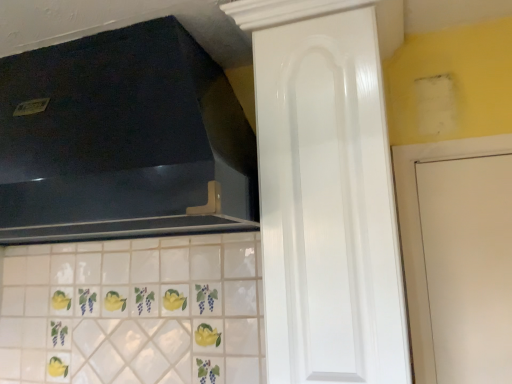
Measure the distance between point (276, 61) and camera.

Point (276, 61) and camera are 3.34 feet apart.

The width and height of the screenshot is (512, 384). In order to click on white glossy cabinet door at center in this screenshot , I will do `click(328, 205)`.

Describe the element at coordinates (328, 205) in the screenshot. This screenshot has width=512, height=384. I see `white glossy cabinet door at center` at that location.

Where is `white glossy cabinet door at center`? The height and width of the screenshot is (384, 512). white glossy cabinet door at center is located at coordinates (328, 205).